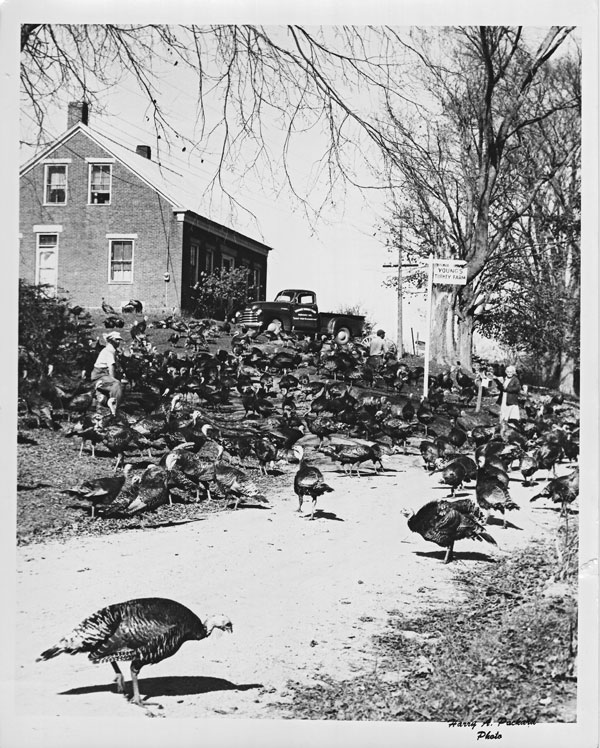
The width and height of the screenshot is (600, 748). I want to click on the bottom floor, so click(x=156, y=260).